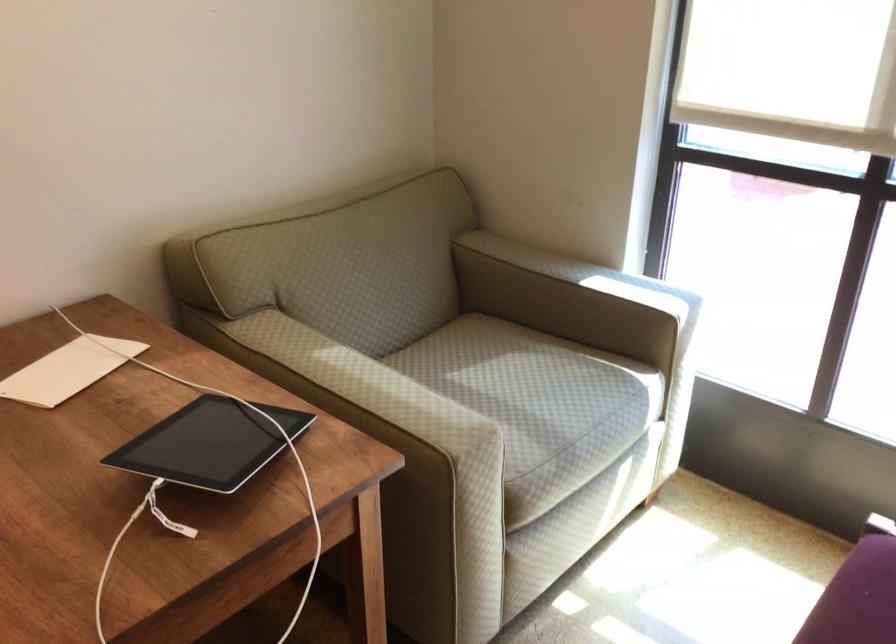
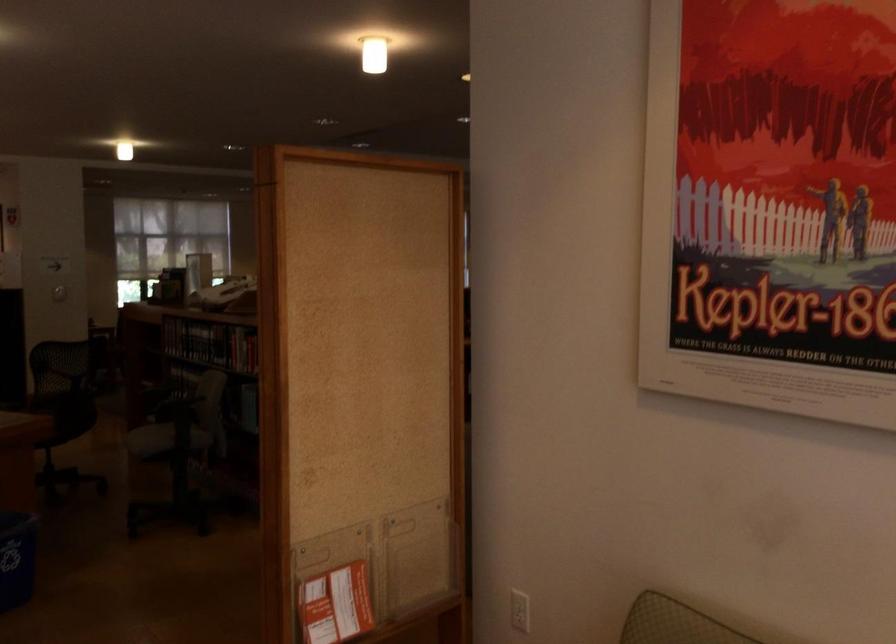
Question: The camera is either moving clockwise (left) or counter-clockwise (right) around the object. The first image is from the beginning of the video and the second image is from the end. Is the camera moving left or right when shooting the video?

Choices:
 (A) Left
 (B) Right

Answer: (B)